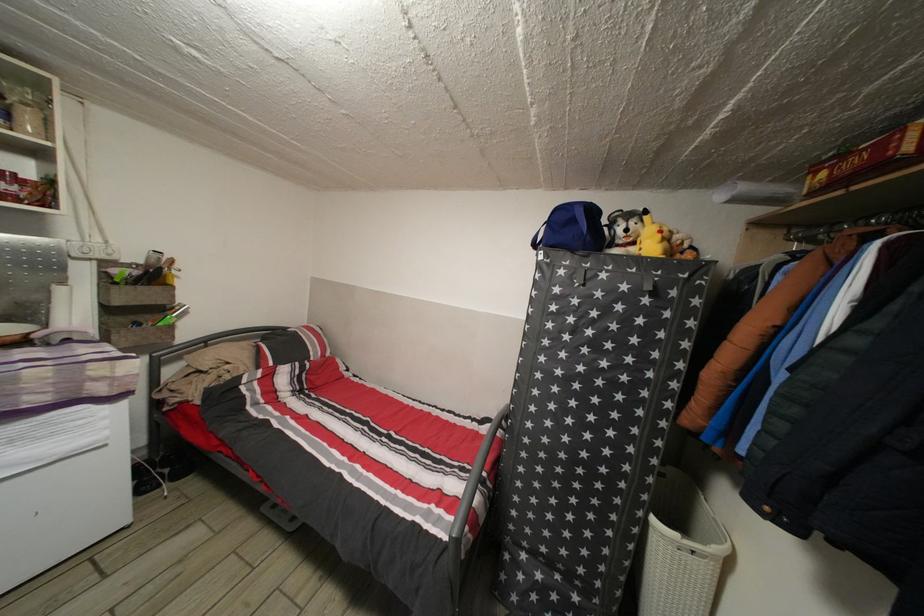
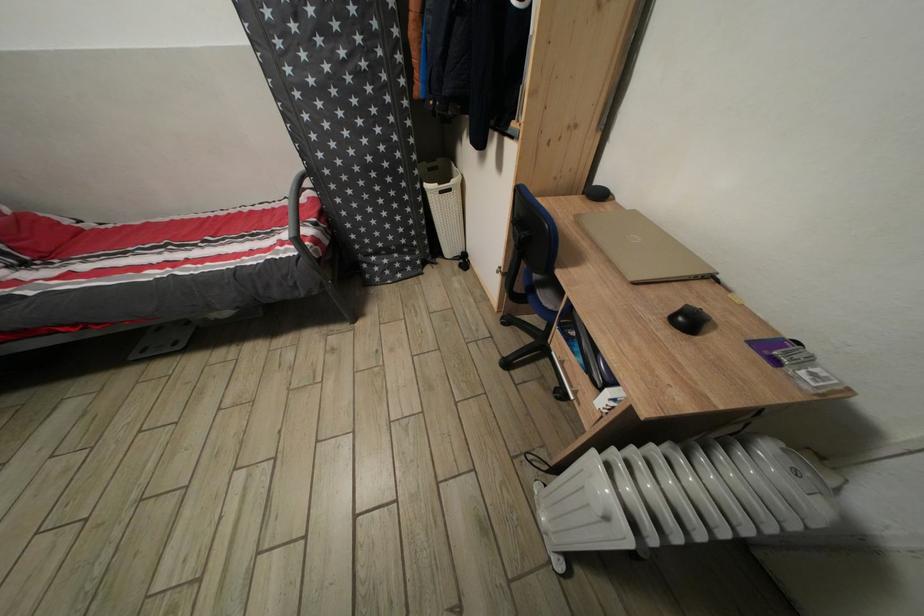
Find the pixel in the second image that matches point (661, 525) in the first image.

(432, 192)